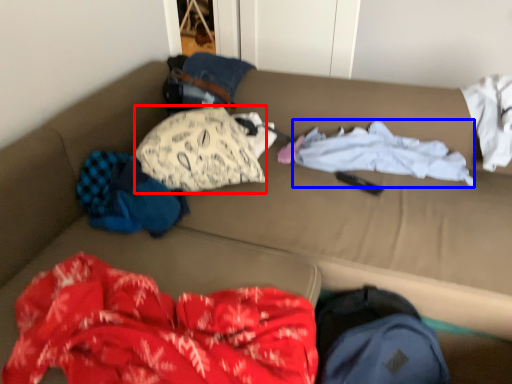
Question: Which object is closer to the camera taking this photo, clothing (highlighted by a red box) or clothing (highlighted by a blue box)?

Choices:
 (A) clothing
 (B) clothing

Answer: (A)